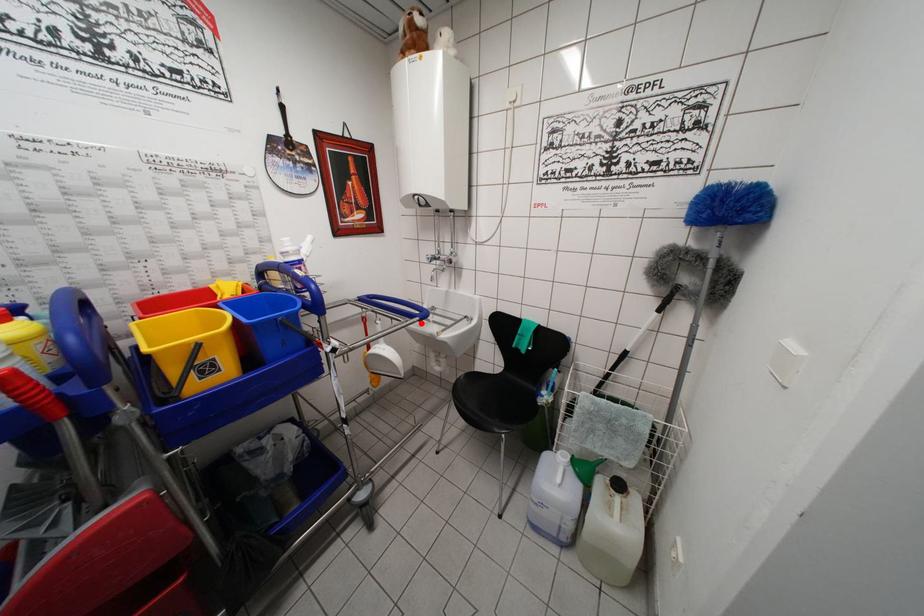
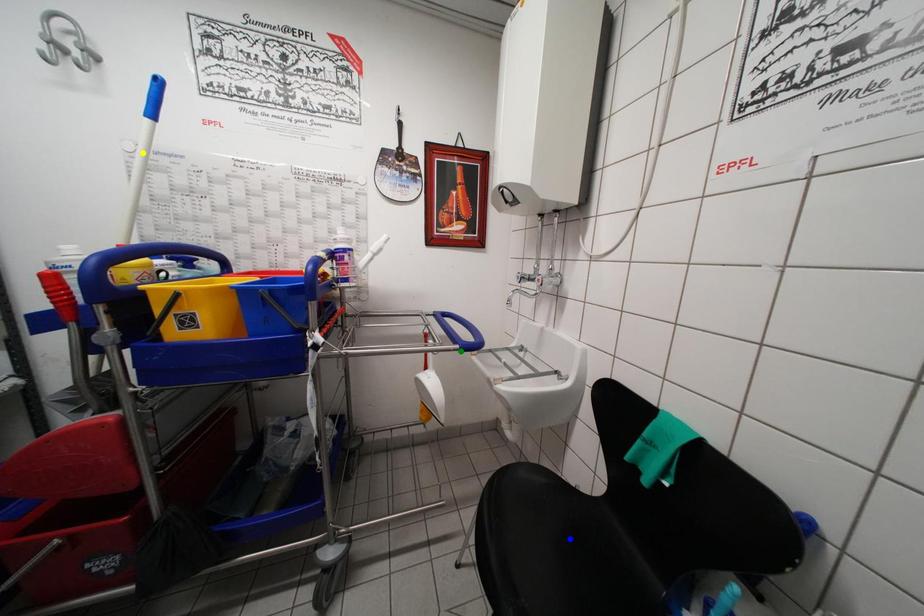
Question: I am providing you with two images of the same scene from different viewpoints. A red point is marked on the first image. You are given multiple points on the second image. Which point in image 2 is actually the same real-world point as the red point in image 1?

Choices:
 (A) yellow point
 (B) green point
 (C) blue point

Answer: (B)